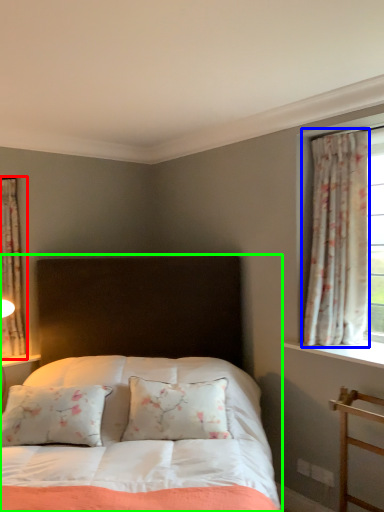
Question: Which is farther away from curtain (highlighted by a red box)? curtain (highlighted by a blue box) or bed (highlighted by a green box)?

Choices:
 (A) curtain
 (B) bed

Answer: (A)